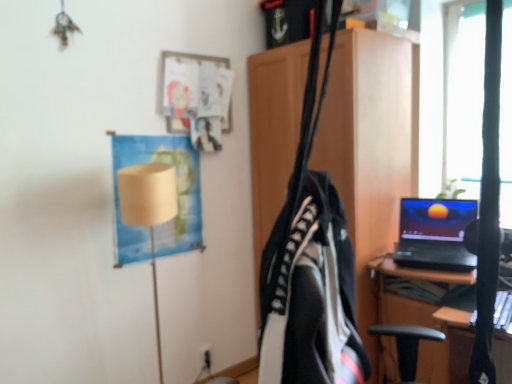
Question: In terms of width, does wooden cabinet at center look wider or thinner when compared to beige fabric lampshade at left?

Choices:
 (A) thin
 (B) wide

Answer: (B)

Question: From the image's perspective, is wooden cabinet at center positioned above or below beige fabric lampshade at left?

Choices:
 (A) below
 (B) above

Answer: (B)

Question: Estimate the real-world distances between objects in this image. Which object is closer to the beige fabric lampshade at left?

Choices:
 (A) black fabric bag at center
 (B) black fabric backpack at center
 (C) wooden cabinet at center
 (D) beige paper lampshade at upper left
 (E) black plastic electric outlet at lower center

Answer: (D)

Question: Which of these objects is positioned farthest from the black fabric bag at center?

Choices:
 (A) black plastic electric outlet at lower center
 (B) black fabric backpack at center
 (C) beige paper lampshade at upper left
 (D) beige fabric lampshade at left
 (E) wooden cabinet at center

Answer: (A)